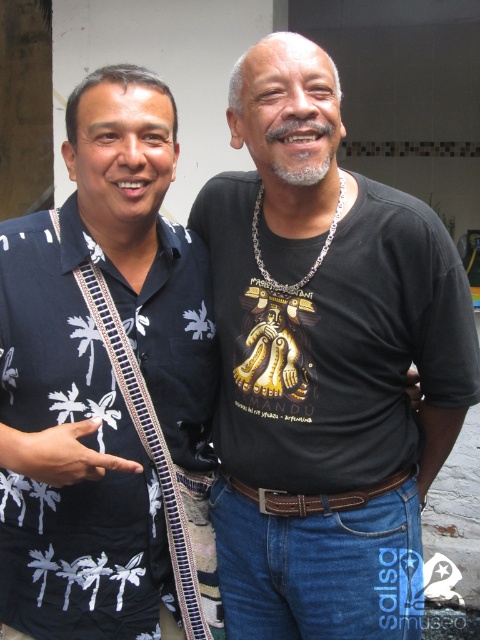
Between black matte t-shirt at center and brown leather belt at center, which one has less height?

brown leather belt at center

Does black matte t-shirt at center appear on the left side of brown leather belt at center?

In fact, black matte t-shirt at center is to the right of brown leather belt at center.

The height and width of the screenshot is (640, 480). Identify the location of black matte t-shirt at center. (324, 365).

Which of these two, black matte t-shirt at center or white printed palm tree shirt at left, stands taller?

Standing taller between the two is black matte t-shirt at center.

Does black matte t-shirt at center appear on the right side of white printed palm tree shirt at left?

Indeed, black matte t-shirt at center is positioned on the right side of white printed palm tree shirt at left.

Locate an element on the screen. black matte t-shirt at center is located at coordinates (324, 365).

Find the location of a particular element. The height and width of the screenshot is (640, 480). black matte t-shirt at center is located at coordinates (324, 365).

Is point (31, 346) farther from viewer compared to point (286, 513)?

No.

Between point (136, 269) and point (365, 499), which one is positioned in front?

Positioned in front is point (365, 499).

At what (x,y) coordinates should I click in order to perform the action: click on white printed palm tree shirt at left. Please return your answer as a coordinate pair (x, y). The height and width of the screenshot is (640, 480). Looking at the image, I should click on (107, 387).